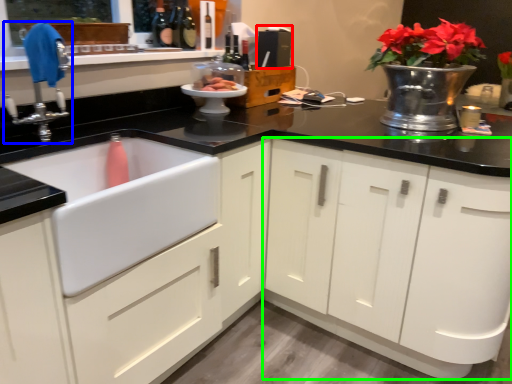
Question: Considering the real-world distances, which object is farthest from appliance (highlighted by a red box)? tap (highlighted by a blue box) or cabinetry (highlighted by a green box)?

Choices:
 (A) tap
 (B) cabinetry

Answer: (A)